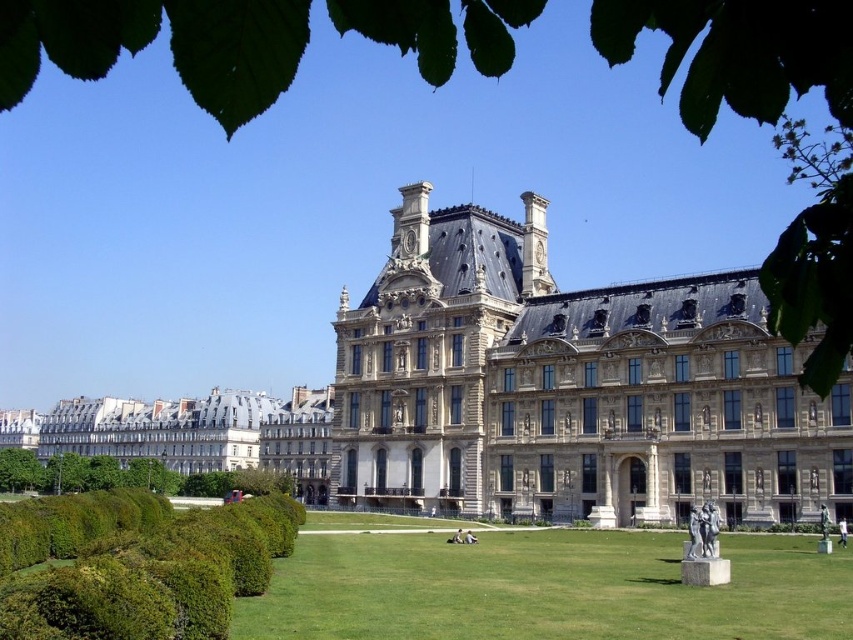
You are a photographer planning to capture the beige stone palace at center and the white marble statue at lower right in a single frame. Based on their sizes, which object should you focus on to ensure both are clearly visible in the photo?

The beige stone palace at center is larger than the white marble statue at lower right, so focusing on the palace will help ensure both objects are clearly visible in the photo.

You are standing at the entrance of the grand historic building and want to walk to the green grass at center. According to the coordinates provided, in which direction should you move relative to the building?

The green grass at center is located at coordinate point (543, 588). Since coordinates typically increase from the bottom left corner, moving towards higher x and y values would mean moving to the right and upwards. However, since you are at the entrance of the building, which is likely at the front facing the lawn, you should move forward towards the green grass at center as it is positioned in the center of the scene.

You are standing on the green grass at center and want to move to the white marble statue at lower right. Is the statue above or below you?

The green grass at center is positioned under the white marble statue at lower right, so the statue is above you.